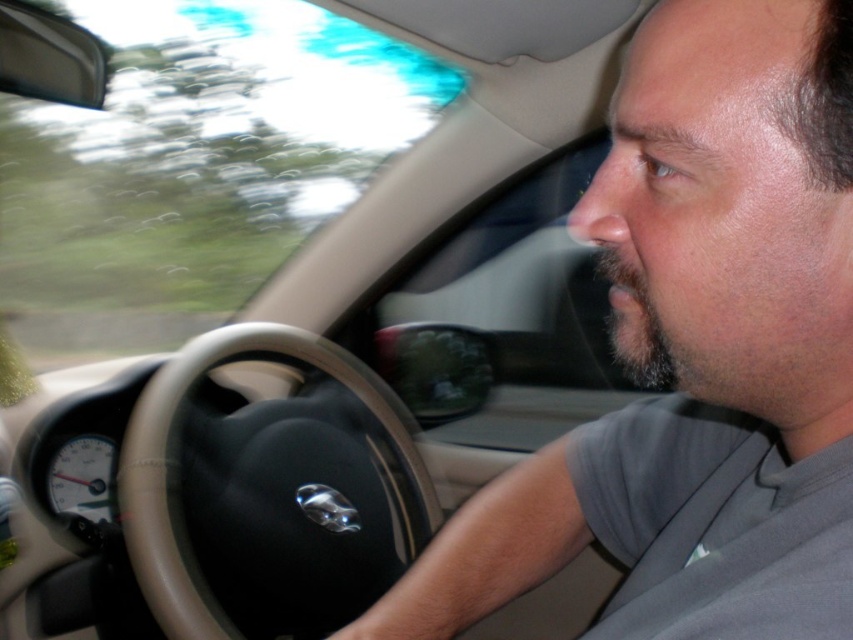
From the picture: You are a passenger in the car and want to know if your phone can fit between the gray fabric shirt at center and the black leather steering wheel at center. The phone is 10 cm wide. Can it fit?

The gray fabric shirt at center is narrower than the black leather steering wheel at center. Since the shirt is narrower, the space between them might be sufficient for a 10 cm wide phone. However, without exact measurements of the gap, it is uncertain. The description only states the shirt is narrower, not the distance between them.

You are a passenger sitting in the back seat of the car. Looking forward, you notice the gray fabric shirt at center and the black leather steering wheel at center. Which object is positioned higher from the ground?

The gray fabric shirt at center is above the black leather steering wheel at center, so the gray fabric shirt at center is higher from the ground.